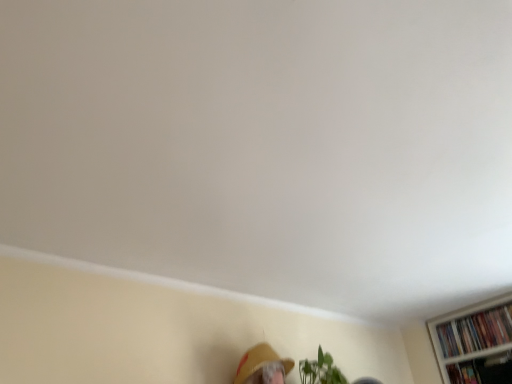
Locate an element on the screen. The height and width of the screenshot is (384, 512). multicolored paperbacks at upper right, the first book positioned from the back is located at coordinates (476, 331).

The height and width of the screenshot is (384, 512). What do you see at coordinates (259, 361) in the screenshot? I see `matte yellow hat at lower center` at bounding box center [259, 361].

Find the location of `multicolored paperbacks at upper right, the 2th book viewed from the front`. multicolored paperbacks at upper right, the 2th book viewed from the front is located at coordinates click(x=476, y=331).

Are matte yellow hat at lower center and black matte bookshelf at lower right, positioned as the 1th book in front-to-back order, far apart?

Indeed, matte yellow hat at lower center is not near black matte bookshelf at lower right, positioned as the 1th book in front-to-back order.

From the image's perspective, is matte yellow hat at lower center over black matte bookshelf at lower right, positioned as the 1th book in front-to-back order?

Yes.

Who is bigger, matte yellow hat at lower center or black matte bookshelf at lower right, positioned as the 1th book in front-to-back order?

matte yellow hat at lower center is bigger.

Between matte yellow hat at lower center and black matte bookshelf at lower right, the 2th book viewed from the back, which one has more height?

With more height is matte yellow hat at lower center.

Which is less distant, (479, 378) or (462, 343)?

Point (479, 378) appears to be closer to the viewer than point (462, 343).

From the image's perspective, is black matte bookshelf at lower right, positioned as the 1th book in front-to-back order, over multicolored paperbacks at upper right, the 2th book viewed from the front?

No.

Find the location of a particular element. This screenshot has width=512, height=384. book above the black matte bookshelf at lower right, positioned as the 1th book in front-to-back order (from a real-world perspective) is located at coordinates (476, 331).

In the image, is black matte bookshelf at lower right, positioned as the 1th book in front-to-back order, on the left side or the right side of multicolored paperbacks at upper right, the 2th book viewed from the front?

Clearly, black matte bookshelf at lower right, positioned as the 1th book in front-to-back order, is on the right of multicolored paperbacks at upper right, the 2th book viewed from the front, in the image.

Where is `person below the multicolored paperbacks at upper right, the 2th book viewed from the front (from a real-world perspective)`? The width and height of the screenshot is (512, 384). person below the multicolored paperbacks at upper right, the 2th book viewed from the front (from a real-world perspective) is located at coordinates (259, 361).

From a real-world perspective, between matte yellow hat at lower center and multicolored paperbacks at upper right, the 2th book viewed from the front, who is vertically lower?

matte yellow hat at lower center is physically lower.

Consider the image. Which is correct: matte yellow hat at lower center is inside multicolored paperbacks at upper right, the 2th book viewed from the front, or outside of it?

matte yellow hat at lower center is spatially situated outside multicolored paperbacks at upper right, the 2th book viewed from the front.

From the picture: From the image's perspective, is matte yellow hat at lower center under multicolored paperbacks at upper right, the 2th book viewed from the front?

No.

Is black matte bookshelf at lower right, the 2th book viewed from the back, not near matte yellow hat at lower center?

Yes, black matte bookshelf at lower right, the 2th book viewed from the back, and matte yellow hat at lower center are located far from each other.

Considering the points (457, 380) and (268, 344), which point is behind, point (457, 380) or point (268, 344)?

The point (457, 380) is more distant.

From the picture: Which of these two, black matte bookshelf at lower right, positioned as the 1th book in front-to-back order, or matte yellow hat at lower center, is thinner?

black matte bookshelf at lower right, positioned as the 1th book in front-to-back order.

From the image's perspective, is black matte bookshelf at lower right, the 2th book viewed from the back, above matte yellow hat at lower center?

No, from the image's perspective, black matte bookshelf at lower right, the 2th book viewed from the back, is not above matte yellow hat at lower center.

Measure the distance between multicolored paperbacks at upper right, the 2th book viewed from the front, and matte yellow hat at lower center.

They are 1.19 meters apart.

You are a GUI agent. You are given a task and a screenshot of the screen. Output one action in this format:
    pyautogui.click(x=<x>, y=<y>)
    Task: Click on the person below the multicolored paperbacks at upper right, the first book positioned from the back (from a real-world perspective)
    The image size is (512, 384).
    Given the screenshot: What is the action you would take?
    pyautogui.click(x=259, y=361)

From a real-world perspective, does multicolored paperbacks at upper right, the 2th book viewed from the front, sit lower than matte yellow hat at lower center?

No, from a real-world perspective, multicolored paperbacks at upper right, the 2th book viewed from the front, is not below matte yellow hat at lower center.

Considering the points (501, 340) and (260, 344), which point is behind, point (501, 340) or point (260, 344)?

The point (501, 340) is behind.

Is multicolored paperbacks at upper right, the first book positioned from the back, to the left or to the right of black matte bookshelf at lower right, the 2th book viewed from the back, in the image?

From the image, it's evident that multicolored paperbacks at upper right, the first book positioned from the back, is to the left of black matte bookshelf at lower right, the 2th book viewed from the back.

In terms of size, does multicolored paperbacks at upper right, the first book positioned from the back, appear bigger or smaller than black matte bookshelf at lower right, positioned as the 1th book in front-to-back order?

multicolored paperbacks at upper right, the first book positioned from the back, is bigger than black matte bookshelf at lower right, positioned as the 1th book in front-to-back order.

Is point (472, 340) closer or farther from the camera than point (451, 372)?

Clearly, point (472, 340) is closer to the camera than point (451, 372).

From a real-world perspective, is multicolored paperbacks at upper right, the first book positioned from the back, above or below black matte bookshelf at lower right, the 2th book viewed from the back?

multicolored paperbacks at upper right, the first book positioned from the back, is above black matte bookshelf at lower right, the 2th book viewed from the back.

Identify the location of person in front of the black matte bookshelf at lower right, positioned as the 1th book in front-to-back order. (259, 361).

Where is `book behind the black matte bookshelf at lower right, the 2th book viewed from the back`? The height and width of the screenshot is (384, 512). book behind the black matte bookshelf at lower right, the 2th book viewed from the back is located at coordinates (476, 331).

Looking at the image, which one is located further to black matte bookshelf at lower right, the 2th book viewed from the back, multicolored paperbacks at upper right, the 2th book viewed from the front, or matte yellow hat at lower center?

matte yellow hat at lower center.

Based on their spatial positions, is multicolored paperbacks at upper right, the 2th book viewed from the front, or black matte bookshelf at lower right, positioned as the 1th book in front-to-back order, closer to matte yellow hat at lower center?

The object closer to matte yellow hat at lower center is multicolored paperbacks at upper right, the 2th book viewed from the front.

Which object lies further to the anchor point multicolored paperbacks at upper right, the 2th book viewed from the front, black matte bookshelf at lower right, positioned as the 1th book in front-to-back order, or matte yellow hat at lower center?

matte yellow hat at lower center is positioned further to the anchor multicolored paperbacks at upper right, the 2th book viewed from the front.

From the image, which object appears to be farther from matte yellow hat at lower center, black matte bookshelf at lower right, positioned as the 1th book in front-to-back order, or multicolored paperbacks at upper right, the 2th book viewed from the front?

Among the two, black matte bookshelf at lower right, positioned as the 1th book in front-to-back order, is located further to matte yellow hat at lower center.

From the picture: Which object lies further to the anchor point multicolored paperbacks at upper right, the first book positioned from the back, matte yellow hat at lower center or black matte bookshelf at lower right, positioned as the 1th book in front-to-back order?

matte yellow hat at lower center lies further to multicolored paperbacks at upper right, the first book positioned from the back, than the other object.

Looking at the image, which one is located further to black matte bookshelf at lower right, positioned as the 1th book in front-to-back order, matte yellow hat at lower center or multicolored paperbacks at upper right, the first book positioned from the back?

matte yellow hat at lower center is positioned further to the anchor black matte bookshelf at lower right, positioned as the 1th book in front-to-back order.

Where is `book between matte yellow hat at lower center and black matte bookshelf at lower right, positioned as the 1th book in front-to-back order, from left to right`? This screenshot has width=512, height=384. book between matte yellow hat at lower center and black matte bookshelf at lower right, positioned as the 1th book in front-to-back order, from left to right is located at coordinates (476, 331).